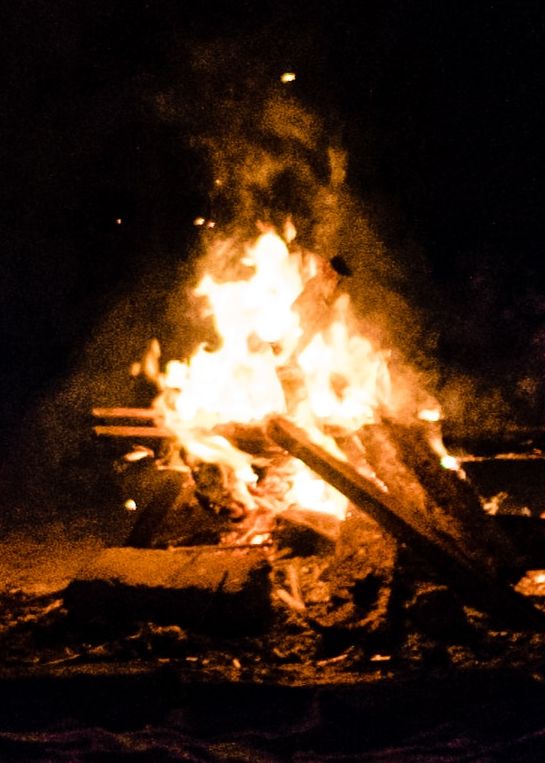
Image resolution: width=545 pixels, height=763 pixels. I want to click on light in the background, so 198,219, 215,224, 216,179, 118,221, 289,76.